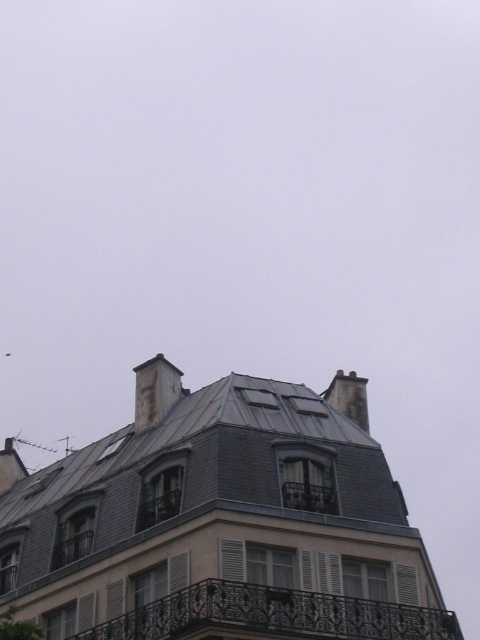
In the scene shown: You are standing 60 meters away from the dark gray stone chimney at upper center. Can you safely walk closer to it without exceeding the maximum allowed distance of 60 meters?

The dark gray stone chimney at upper center is 61.21 meters away from the camera, so if you are already standing 60 meters away, moving closer would exceed the maximum allowed distance of 60 meters. Therefore, you cannot safely walk closer without violating the distance restriction.

You are standing on the street in front of this building and want to take a photo of the metallic balcony at center and the smooth gray chimney at upper left. From your current position, which object is closer to the left side of the photo frame?

The smooth gray chimney at upper left is closer to the left side of the photo frame because the metallic balcony at center is positioned to its right.